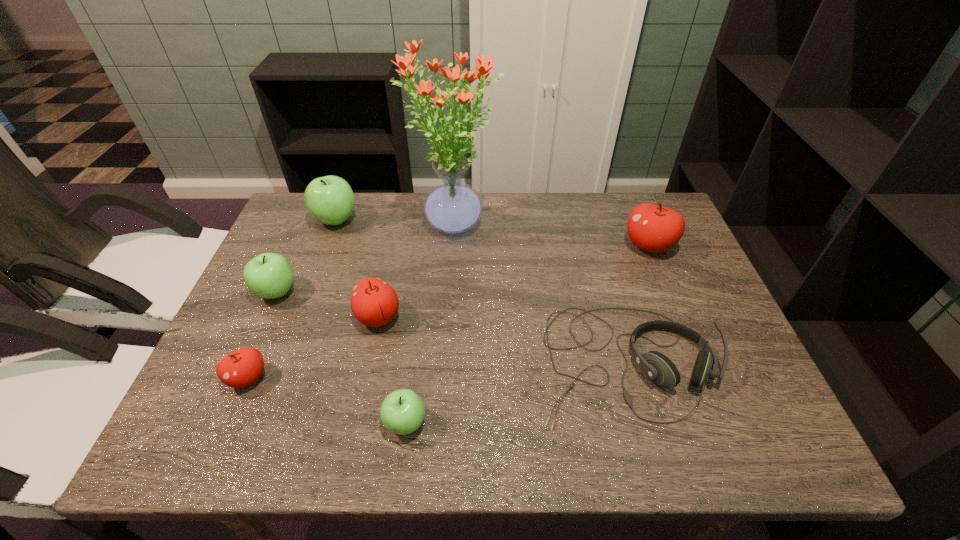
You are a GUI agent. You are given a task and a screenshot of the screen. Output one action in this format:
    pyautogui.click(x=<x>, y=<y>)
    Task: Click on the tallest object
    
    Given the screenshot: What is the action you would take?
    pyautogui.click(x=452, y=207)

The height and width of the screenshot is (540, 960). I want to click on flower arrangement, so click(452, 207).

Locate an element on the screen. The image size is (960, 540). the rightmost apple is located at coordinates (653, 228).

This screenshot has width=960, height=540. In order to click on the rightmost red apple in this screenshot , I will do (x=653, y=228).

Identify the location of the farthest green apple. (330, 199).

At what (x,y) coordinates should I click in order to perform the action: click on the second smallest green apple. Please return your answer as a coordinate pair (x, y). The height and width of the screenshot is (540, 960). Looking at the image, I should click on (269, 275).

You are a GUI agent. You are given a task and a screenshot of the screen. Output one action in this format:
    pyautogui.click(x=<x>, y=<y>)
    Task: Click on the second biggest red apple
    The image size is (960, 540).
    Given the screenshot: What is the action you would take?
    pyautogui.click(x=374, y=303)

The image size is (960, 540). What are the coordinates of `the second red apple from right to left` in the screenshot? It's located at (374, 303).

This screenshot has width=960, height=540. Identify the location of headset. (656, 366).

Locate an element on the screen. This screenshot has width=960, height=540. the second nearest apple is located at coordinates (242, 367).